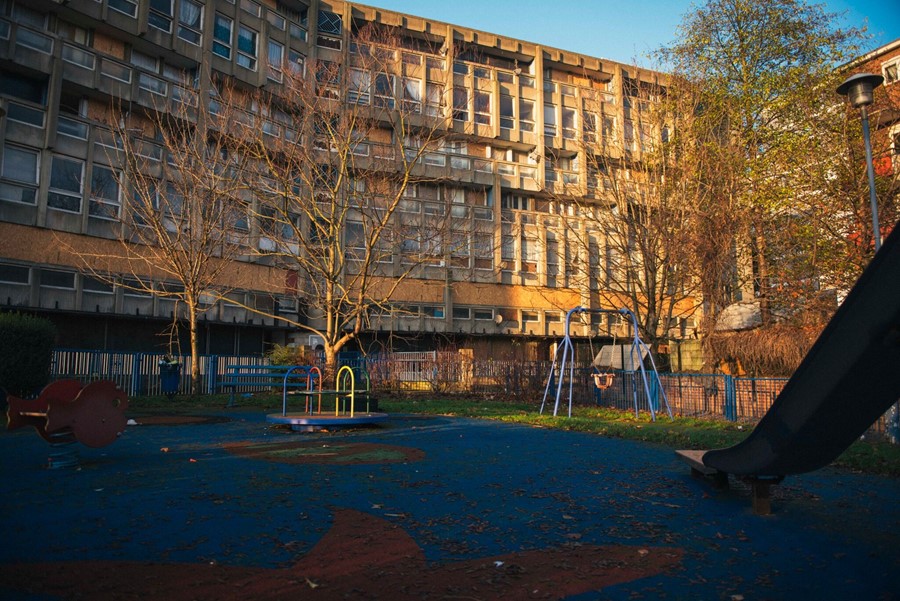
Where is `light`? The height and width of the screenshot is (601, 900). light is located at coordinates [862, 104].